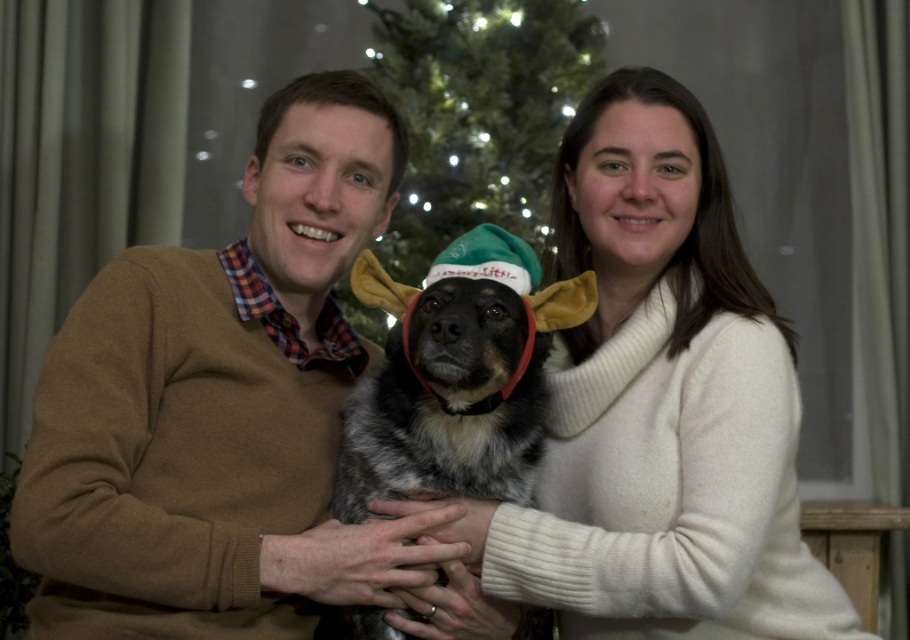
How distant is brown sweater at center from white woolen sweater at center?

A distance of 13.08 inches exists between brown sweater at center and white woolen sweater at center.

Measure the distance between brown sweater at center and camera.

A distance of 3.97 feet exists between brown sweater at center and camera.

Is point (288, 282) farther from viewer compared to point (550, 435)?

No, (288, 282) is closer to viewer.

Identify the location of brown sweater at center. (221, 408).

Does white woolen sweater at center have a greater width compared to green textured christmas tree at center?

Yes.

Which is in front, point (650, 330) or point (468, 138)?

Point (650, 330) is more forward.

Locate an element on the screen. The image size is (910, 640). white woolen sweater at center is located at coordinates pyautogui.click(x=661, y=404).

Who is taller, brown sweater at center or speckled fur dog at center?

brown sweater at center

This screenshot has width=910, height=640. In order to click on brown sweater at center in this screenshot , I will do `click(221, 408)`.